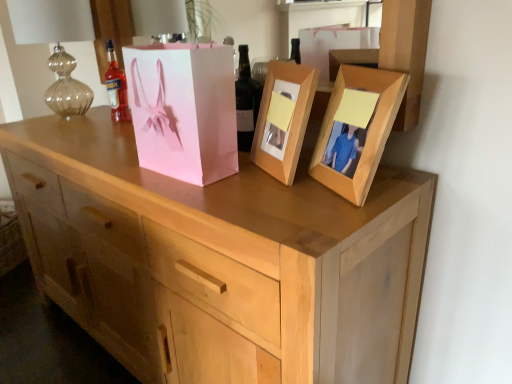
Question: Does light wood chest of drawers at center have a lesser height compared to wooden photo frame at upper right, acting as the 1th picture frame starting from the right?

Choices:
 (A) yes
 (B) no

Answer: (B)

Question: From a real-world perspective, is light wood chest of drawers at center beneath wooden photo frame at upper right, which is the second picture frame from left to right?

Choices:
 (A) yes
 (B) no

Answer: (A)

Question: Is light wood chest of drawers at center aimed at wooden photo frame at upper right, which is the second picture frame from left to right?

Choices:
 (A) yes
 (B) no

Answer: (B)

Question: Is light wood chest of drawers at center oriented away from wooden photo frame at upper right, which is the second picture frame from left to right?

Choices:
 (A) yes
 (B) no

Answer: (B)

Question: Is light wood chest of drawers at center not near wooden photo frame at upper right, acting as the 1th picture frame starting from the right?

Choices:
 (A) no
 (B) yes

Answer: (A)

Question: Is translucent glass bottle at upper left, acting as the 2th bottle starting from the right, to the left or to the right of dark brown glass bottle at center, marked as the second bottle in a back-to-front arrangement, in the image?

Choices:
 (A) left
 (B) right

Answer: (A)

Question: Considering their positions, is translucent glass bottle at upper left, acting as the 2th bottle starting from the right, located in front of or behind dark brown glass bottle at center, the 1th bottle positioned from the right?

Choices:
 (A) front
 (B) behind

Answer: (B)

Question: From the image's perspective, relative to dark brown glass bottle at center, acting as the 1th bottle starting from the front, is translucent glass bottle at upper left, which is the second bottle from front to back, above or below?

Choices:
 (A) above
 (B) below

Answer: (A)

Question: Is translucent glass bottle at upper left, which is the second bottle from front to back, inside the boundaries of dark brown glass bottle at center, the 1th bottle positioned from the right, or outside?

Choices:
 (A) inside
 (B) outside

Answer: (B)

Question: From a real-world perspective, relative to wooden photo frame at upper right, which is the second picture frame from left to right, is light wood chest of drawers at center vertically above or below?

Choices:
 (A) above
 (B) below

Answer: (B)

Question: From the image's perspective, is light wood chest of drawers at center positioned above or below wooden photo frame at upper right, acting as the 1th picture frame starting from the right?

Choices:
 (A) above
 (B) below

Answer: (B)

Question: Do you think light wood chest of drawers at center is within wooden photo frame at upper right, acting as the 1th picture frame starting from the right, or outside of it?

Choices:
 (A) outside
 (B) inside

Answer: (A)

Question: In the image, is light wood chest of drawers at center positioned in front of or behind wooden photo frame at upper right, which is the second picture frame from left to right?

Choices:
 (A) behind
 (B) front

Answer: (B)

Question: In terms of height, does light wood chest of drawers at center look taller or shorter compared to dark brown glass bottle at center, the 2th bottle when ordered from left to right?

Choices:
 (A) tall
 (B) short

Answer: (A)

Question: Considering the positions of light wood chest of drawers at center and dark brown glass bottle at center, marked as the second bottle in a back-to-front arrangement, in the image, is light wood chest of drawers at center wider or thinner than dark brown glass bottle at center, marked as the second bottle in a back-to-front arrangement,?

Choices:
 (A) wide
 (B) thin

Answer: (A)